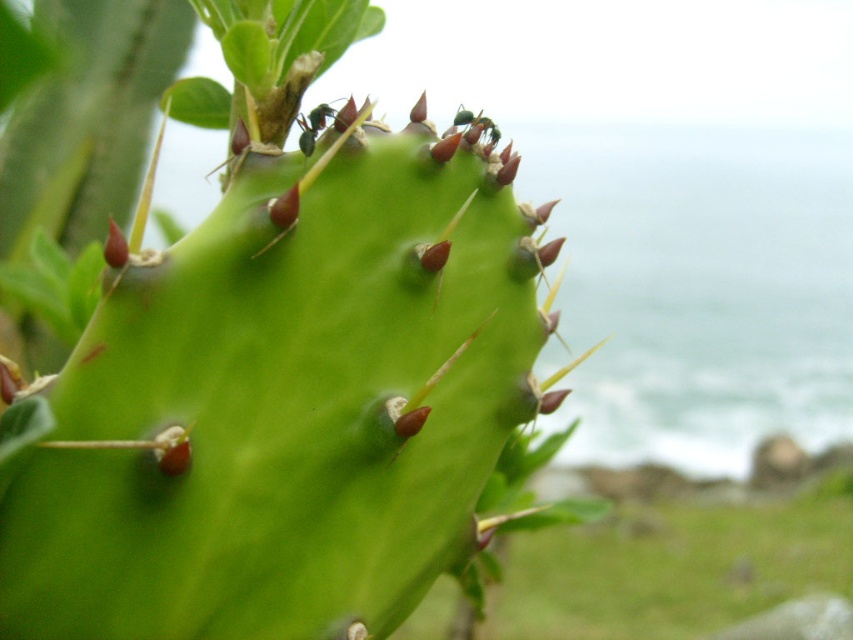
You are a photographer aiming to capture the green spiny cactus at center and the black glossy ant at upper center in a single frame. Based on their positions, which object should you focus on first to ensure both are in focus?

The green spiny cactus at center is positioned under the black glossy ant at upper center, so focusing on the green spiny cactus at center first will help ensure both are in focus since it is closer to the camera.

You are a photographer trying to capture the green spiny cactus at center and the black glossy ant at upper center in a single photo. Given that the camera can only focus on one object at a time, which object should you focus on to ensure the other remains in the background?

You should focus on the green spiny cactus at center because it is larger in width than the black glossy ant at upper center, making it the primary subject. The ant will naturally appear smaller and in the background due to its size difference.

You are a photographer trying to capture the cactus in the image. If you want to get a closer shot without moving the camera, which part of the cactus should you focus on to ensure the point at coordinates point (166, 602) is in focus?

The point at coordinates point (166, 602) is 37.48 inches away from the camera, so you should focus on that specific point to ensure it is in sharp focus.